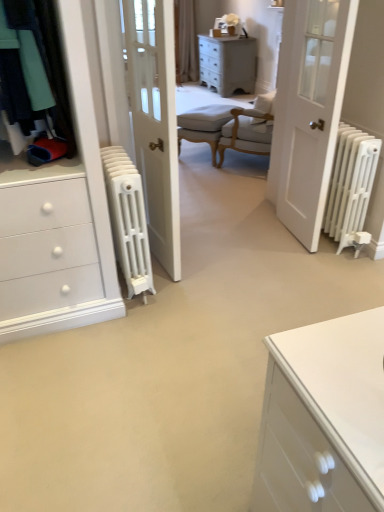
Where is `free point below white matte radiator at right (from a real-world perspective)`? free point below white matte radiator at right (from a real-world perspective) is located at coordinates (288, 234).